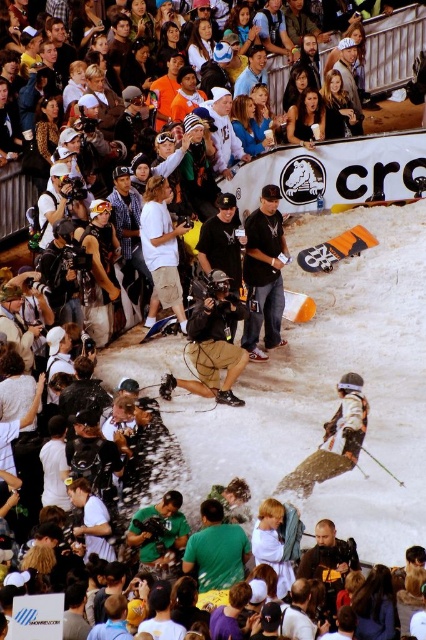
You are a photographer trying to capture both the green matte shirt at center and the white cotton shirt at center in the same frame. Which shirt should you focus on first to ensure both fit in the photo?

The green matte shirt at center has a smaller width than the white cotton shirt at center, so you should focus on the white cotton shirt at center first to ensure both fit in the photo.